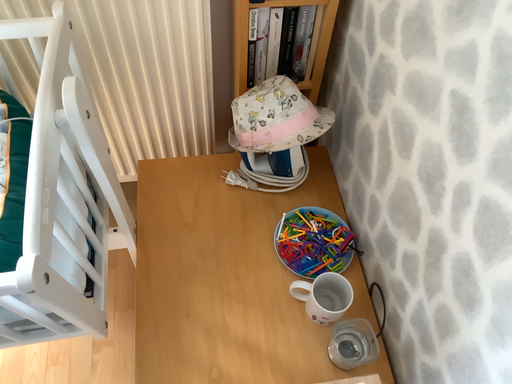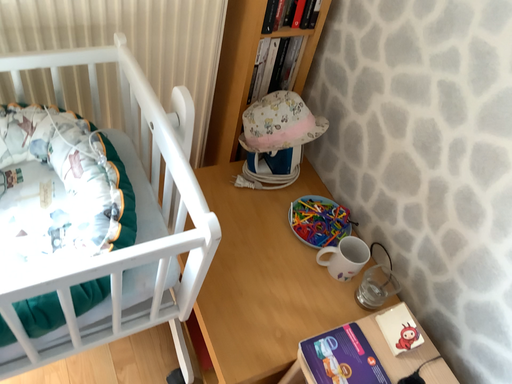
Question: Which way did the camera rotate in the video?

Choices:
 (A) rotated upward
 (B) rotated downward

Answer: (A)